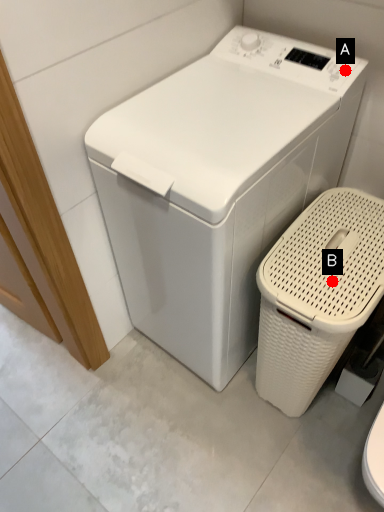
Question: Two points are circled on the image, labeled by A and B beside each circle. Which point is closer to the camera taking this photo?

Choices:
 (A) A is closer
 (B) B is closer

Answer: (B)